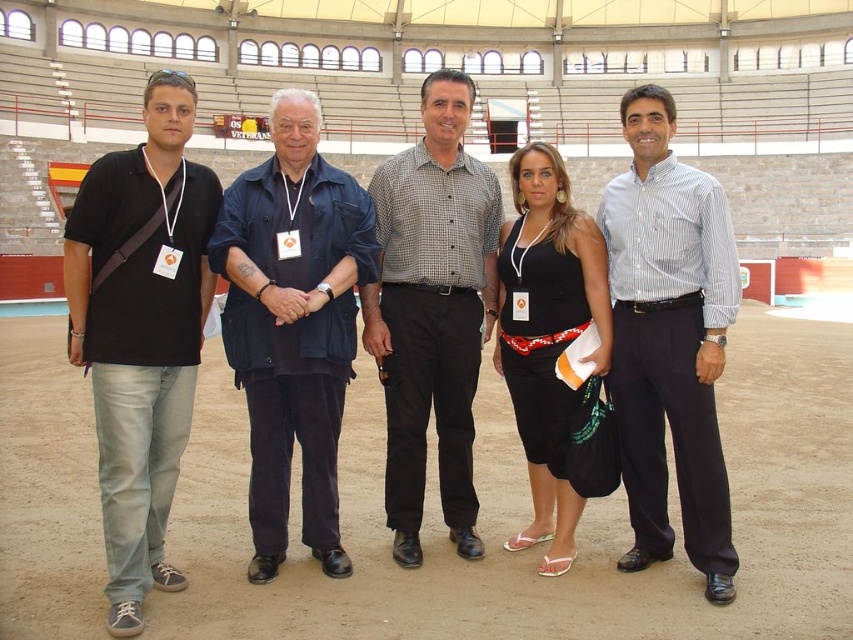
You are a photographer positioned at the front of the arena. You need to take a photo of the dark blue cotton shirt at center and the black fabric dress at center. Which one should you adjust your camera focus to first if you want to capture both clearly?

The dark blue cotton shirt at center is to the left of black fabric dress at center. Since they are both at the same center position, adjusting focus on either first would work as they are aligned horizontally.

You are a photographer at the event and want to capture both the matte black shirt at left and the black fabric dress at center in the same frame. Since both are black, how can you distinguish them in the photo?

The matte black shirt at left is positioned over the black fabric dress at center, so in the photo, the matte black shirt at left will appear in front of the black fabric dress at center, creating a layering effect that distinguishes them.